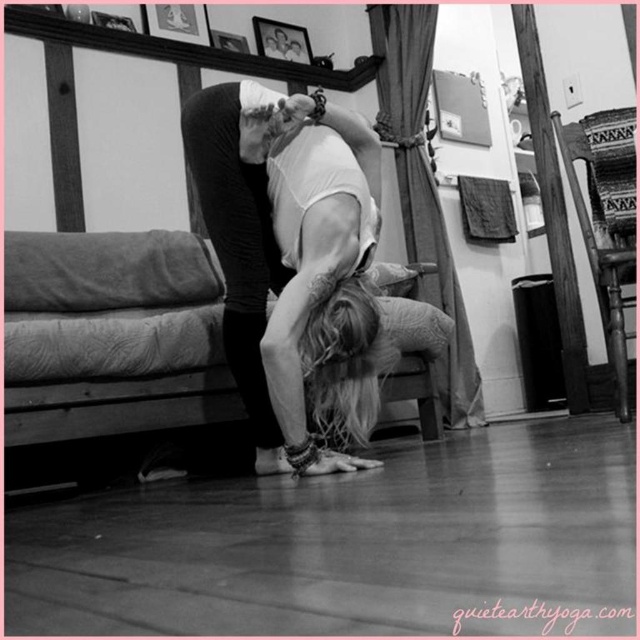
Question: Is white fabric at center wider than wooden picture frame at upper center?

Choices:
 (A) yes
 (B) no

Answer: (A)

Question: In this image, where is white fabric at center located relative to smooth blonde hair at lower center?

Choices:
 (A) above
 (B) below

Answer: (A)

Question: Which point is closer to the camera?

Choices:
 (A) (214, 35)
 (B) (326, 444)

Answer: (B)

Question: Which point is farther to the camera?

Choices:
 (A) smooth blonde hair at lower center
 (B) metallic silver picture frame at upper center

Answer: (B)

Question: Which point appears farthest from the camera in this image?

Choices:
 (A) (177, 4)
 (B) (211, 38)

Answer: (B)

Question: Is metallic silver picture frame at upper center thinner than wooden picture frame at upper center?

Choices:
 (A) yes
 (B) no

Answer: (A)